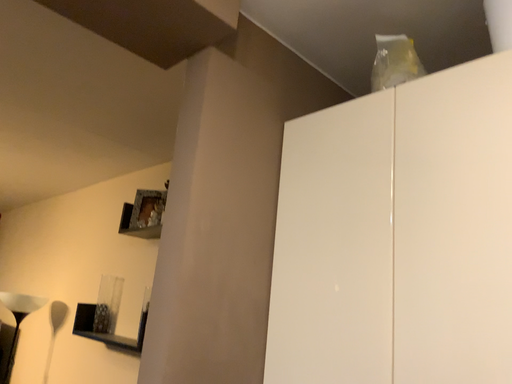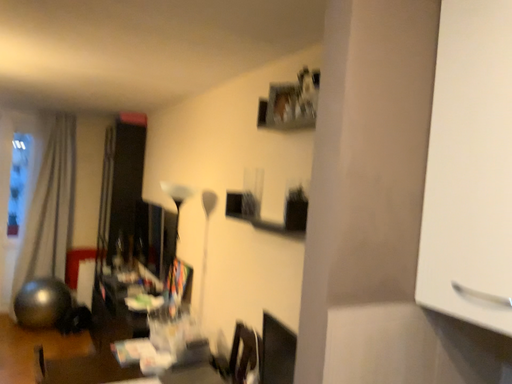
Question: Which way did the camera rotate in the video?

Choices:
 (A) rotated right
 (B) rotated left

Answer: (B)